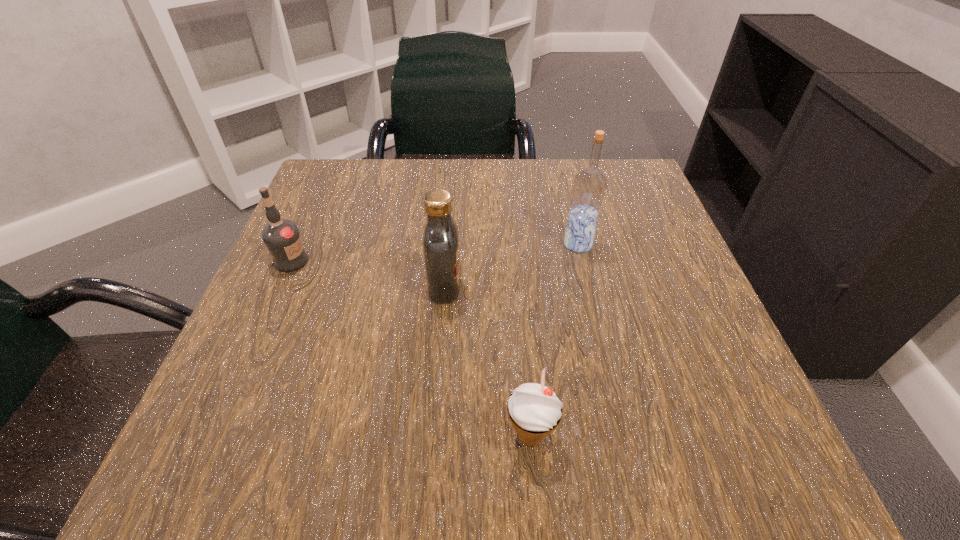
Find the location of a particular element. Image resolution: width=960 pixels, height=540 pixels. the second closest object to the shortest vodka is located at coordinates (534, 407).

The image size is (960, 540). In order to click on object that is the nearest to the icecream in this screenshot , I will do `click(441, 239)`.

Identify which vodka is the second closest to the rightmost vodka. Please provide its 2D coordinates. Your answer should be formatted as a tuple, i.e. [(x, y)], where the tuple contains the x and y coordinates of a point satisfying the conditions above.

[(282, 237)]

Locate an element on the screen. Image resolution: width=960 pixels, height=540 pixels. the closest vodka relative to the rightmost object is located at coordinates (441, 239).

Where is `free space that satisfies the following two spatial constraints: 1. on the back side of the icecream; 2. on the front label of the leftmost object`? free space that satisfies the following two spatial constraints: 1. on the back side of the icecream; 2. on the front label of the leftmost object is located at coordinates (516, 261).

Find the location of `vacant point that satisfies the following two spatial constraints: 1. on the front-facing side of the second vodka from right to left; 2. on the right side of the shortest object`. vacant point that satisfies the following two spatial constraints: 1. on the front-facing side of the second vodka from right to left; 2. on the right side of the shortest object is located at coordinates (433, 436).

The image size is (960, 540). I want to click on free space that satisfies the following two spatial constraints: 1. on the front label of the leftmost object; 2. on the left side of the icecream, so click(214, 436).

The image size is (960, 540). Identify the location of blank space that satisfies the following two spatial constraints: 1. on the front-facing side of the icecream; 2. on the left side of the second tallest object. (433, 436).

Where is `vacant space that satisfies the following two spatial constraints: 1. on the back side of the icecream; 2. on the front-facing side of the second tallest vodka`? vacant space that satisfies the following two spatial constraints: 1. on the back side of the icecream; 2. on the front-facing side of the second tallest vodka is located at coordinates (517, 287).

At what (x,y) coordinates should I click in order to perform the action: click on free space that satisfies the following two spatial constraints: 1. on the front-facing side of the second vodka from left to right; 2. on the left side of the second object from right to left. Please return your answer as a coordinate pair (x, y). The height and width of the screenshot is (540, 960). Looking at the image, I should click on (433, 436).